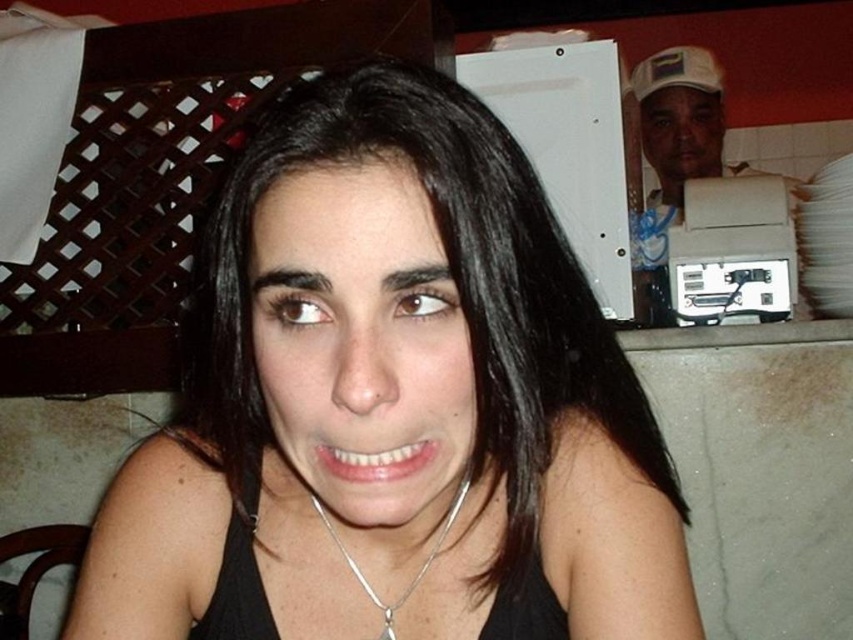
Question: Does white paper towel at upper right appear over silver chain at center?

Choices:
 (A) yes
 (B) no

Answer: (A)

Question: Can you confirm if white paper towel at upper right is wider than silver chain at center?

Choices:
 (A) no
 (B) yes

Answer: (B)

Question: Does white paper towel at upper right have a smaller size compared to silver chain at center?

Choices:
 (A) yes
 (B) no

Answer: (B)

Question: Considering the real-world distances, which object is closest to the black matte tank top at center?

Choices:
 (A) white paper towel at upper right
 (B) silver chain at center

Answer: (B)

Question: Among these objects, which one is nearest to the camera?

Choices:
 (A) black matte tank top at center
 (B) silver chain at center
 (C) white paper towel at upper right

Answer: (A)

Question: Considering the real-world distances, which object is closest to the black matte tank top at center?

Choices:
 (A) white paper towel at upper right
 (B) silver chain at center

Answer: (B)